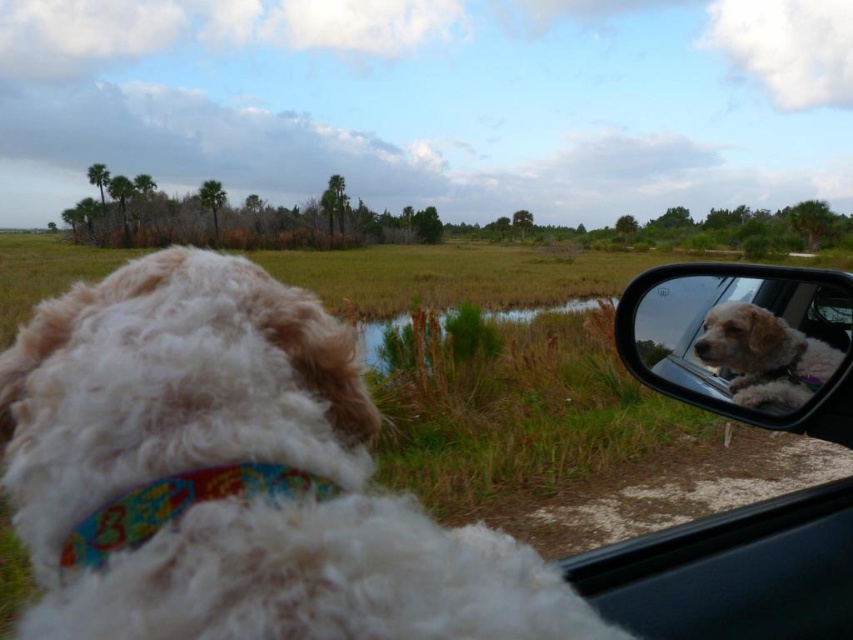
Can you confirm if matte plastic mirror at upper right is shorter than multicolored fabric neckband at lower left?

In fact, matte plastic mirror at upper right may be taller than multicolored fabric neckband at lower left.

Is point (822, 324) positioned in front of point (227, 486)?

No, (822, 324) is further to viewer.

You are a GUI agent. You are given a task and a screenshot of the screen. Output one action in this format:
    pyautogui.click(x=<x>, y=<y>)
    Task: Click on the matte plastic mirror at upper right
    The height and width of the screenshot is (640, 853).
    Given the screenshot: What is the action you would take?
    pyautogui.click(x=740, y=339)

Can you confirm if multicolored fabric neckband at lower left is thinner than white fluffy dog at right?

Correct, multicolored fabric neckband at lower left's width is less than white fluffy dog at right's.

Does multicolored fabric neckband at lower left appear on the right side of white fluffy dog at right?

No, multicolored fabric neckband at lower left is not to the right of white fluffy dog at right.

Identify the location of multicolored fabric neckband at lower left. The width and height of the screenshot is (853, 640). (180, 506).

Can you confirm if white fluffy dog at left is bigger than multicolored fabric neckband at lower left?

Yes.

Is white fluffy dog at left above multicolored fabric neckband at lower left?

Indeed, white fluffy dog at left is positioned over multicolored fabric neckband at lower left.

Identify the location of white fluffy dog at left. (234, 476).